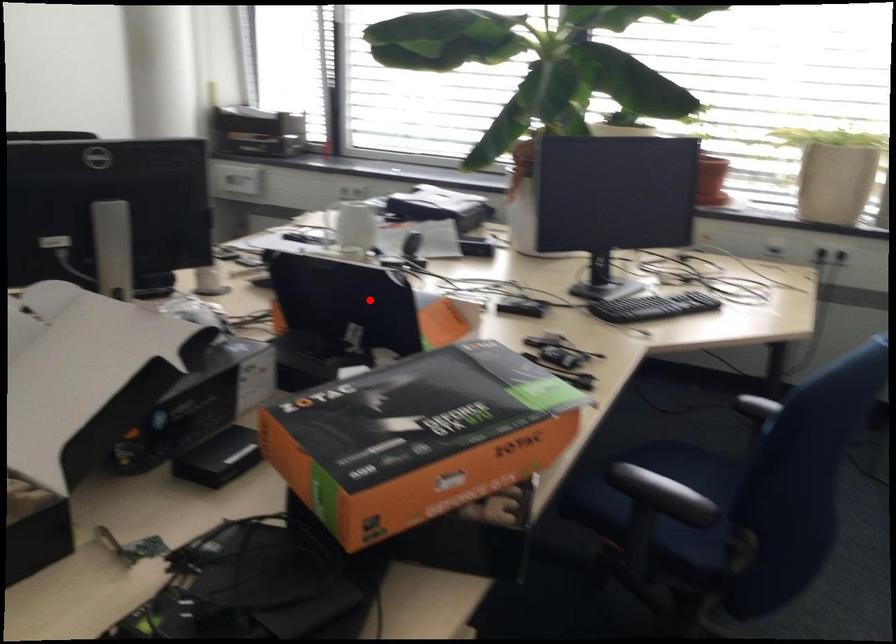
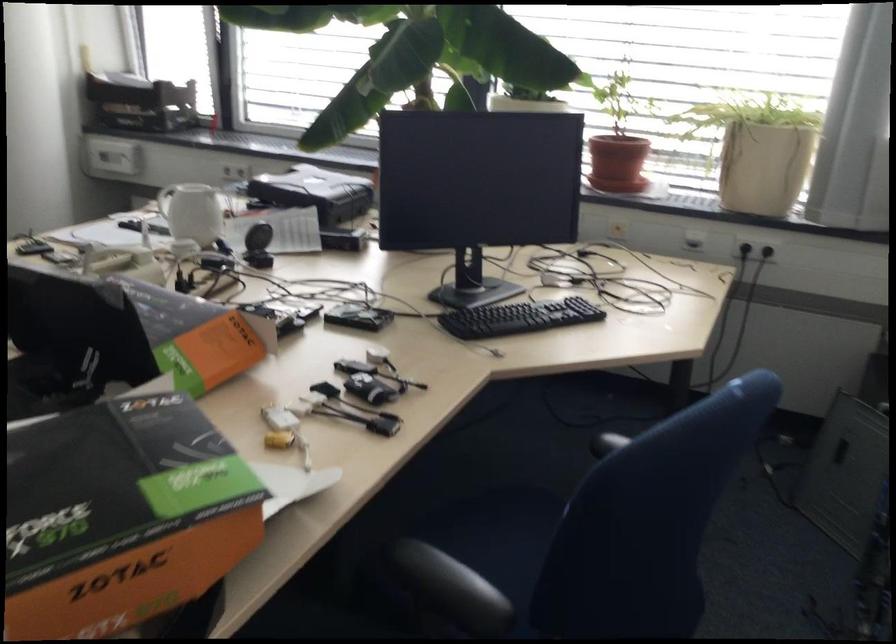
The point at the highlighted location is marked in the first image. Where is the corresponding point in the second image?

(108, 326)